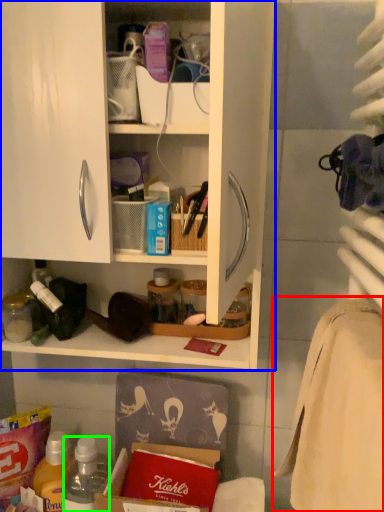
Question: Which object is positioned closest to bath towel (highlighted by a red box)? Select from cabinetry (highlighted by a blue box) and bottle (highlighted by a green box).

Choices:
 (A) cabinetry
 (B) bottle

Answer: (A)